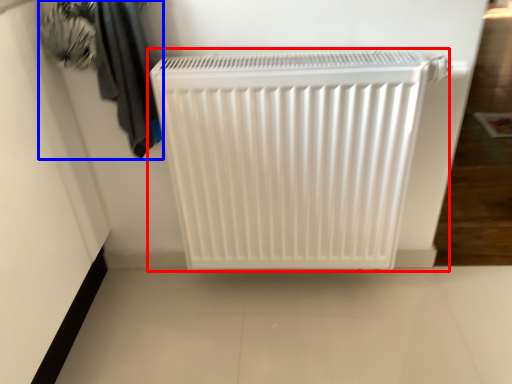
Question: Which point is closer to the camera, home appliance (highlighted by a red box) or laundry (highlighted by a blue box)?

Choices:
 (A) home appliance
 (B) laundry

Answer: (B)